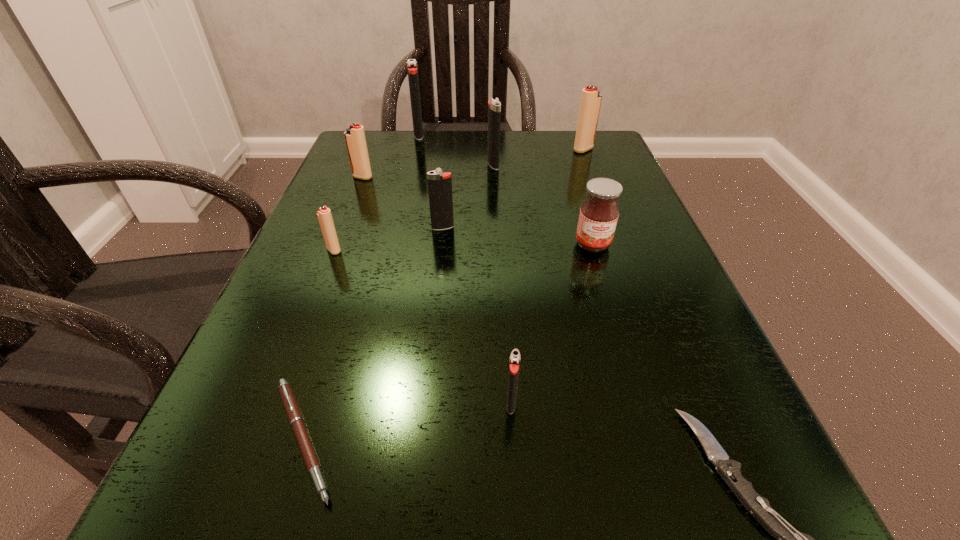
This screenshot has width=960, height=540. In order to click on object that is at the far right corner in this screenshot , I will do `click(590, 104)`.

You are a GUI agent. You are given a task and a screenshot of the screen. Output one action in this format:
    pyautogui.click(x=<x>, y=<y>)
    Task: Click on the vacant space at the far edge
    The width and height of the screenshot is (960, 540).
    Given the screenshot: What is the action you would take?
    pyautogui.click(x=516, y=131)

Locate an element on the screen. Image resolution: width=960 pixels, height=540 pixels. vacant space at the left edge is located at coordinates (369, 245).

Identify the location of free space at the right edge of the desktop. The width and height of the screenshot is (960, 540). (579, 263).

In the image, there is a desktop. Identify the location of vacant region at the far right corner. (567, 175).

Where is `free spot at the near right corner of the desktop`? The height and width of the screenshot is (540, 960). free spot at the near right corner of the desktop is located at coordinates (696, 492).

This screenshot has height=540, width=960. What are the coordinates of `free space that is in between the rightmost red igniter and the second farthest black igniter` in the screenshot? It's located at (539, 157).

Where is `free space that is in between the smallest black igniter and the pink pen`? This screenshot has width=960, height=540. free space that is in between the smallest black igniter and the pink pen is located at coordinates (407, 421).

Locate an element on the screen. The width and height of the screenshot is (960, 540). free space between the fourth nearest igniter and the nearest red igniter is located at coordinates (348, 214).

At what (x,y) coordinates should I click in order to perform the action: click on vacant area that lies between the third farthest object and the sixth farthest igniter. Please return your answer as a coordinate pair (x, y). Looking at the image, I should click on (414, 207).